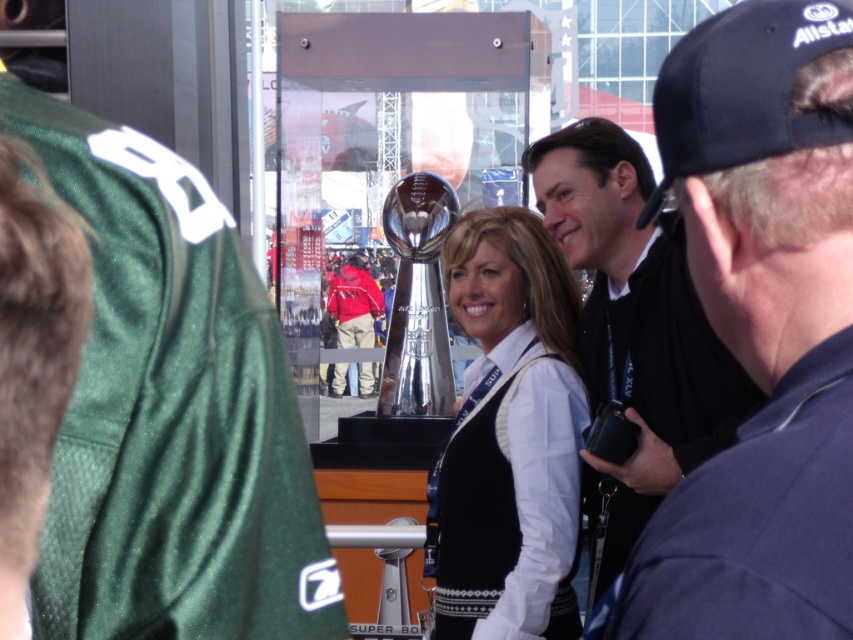
Question: Is white matte vest at center thinner than red jacket at center?

Choices:
 (A) no
 (B) yes

Answer: (B)

Question: Does white matte vest at center have a larger size compared to black fabric baseball cap at upper right?

Choices:
 (A) no
 (B) yes

Answer: (A)

Question: Based on their relative distances, which object is nearer to the dark blue cap at upper right?

Choices:
 (A) black fabric baseball cap at upper right
 (B) red jacket at center

Answer: (A)

Question: Which point appears farthest from the camera in this image?

Choices:
 (A) (666, 422)
 (B) (363, 275)
 (C) (635, 570)

Answer: (B)

Question: Which of the following is the closest to the observer?

Choices:
 (A) [776, 436]
 (B) [595, 337]
 (C) [434, 464]

Answer: (A)

Question: Is black matte jacket at center below red jacket at center?

Choices:
 (A) no
 (B) yes

Answer: (A)